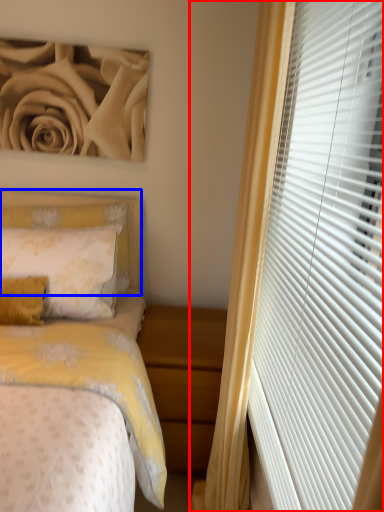
Question: Which of the following is the farthest to the observer, curtain (highlighted by a red box) or headboard (highlighted by a blue box)?

Choices:
 (A) curtain
 (B) headboard

Answer: (B)